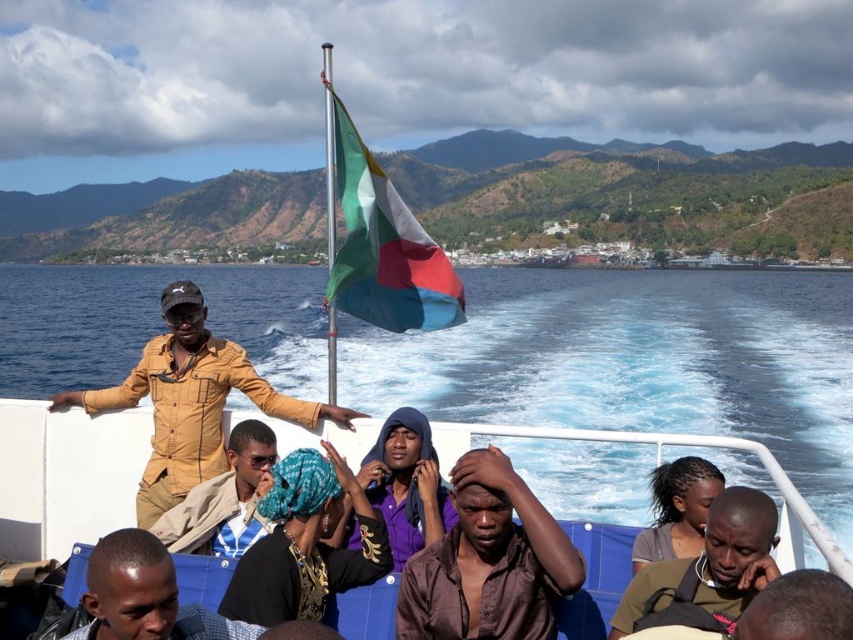
Can you confirm if white plastic boat at center is wider than tan leather jacket at center?

Yes, white plastic boat at center is wider than tan leather jacket at center.

I want to click on white plastic boat at center, so click(x=65, y=476).

Is blue water at lower left above tan leather jacket at center?

Yes, blue water at lower left is above tan leather jacket at center.

How distant is blue water at lower left from tan leather jacket at center?

blue water at lower left is 54.48 meters from tan leather jacket at center.

Between point (9, 280) and point (248, 451), which one is positioned in front?

Point (248, 451) is in front.

In order to click on blue water at lower left in this screenshot , I will do `click(637, 362)`.

This screenshot has height=640, width=853. Find the location of `polyester flag at upper center`. polyester flag at upper center is located at coordinates (384, 248).

From the picture: Is polyester flag at upper center shorter than dark brown hair at center?

No.

Between point (395, 275) and point (686, 532), which one is positioned in front?

Positioned in front is point (686, 532).

Find the location of a particular element. This screenshot has height=640, width=853. polyester flag at upper center is located at coordinates 384,248.